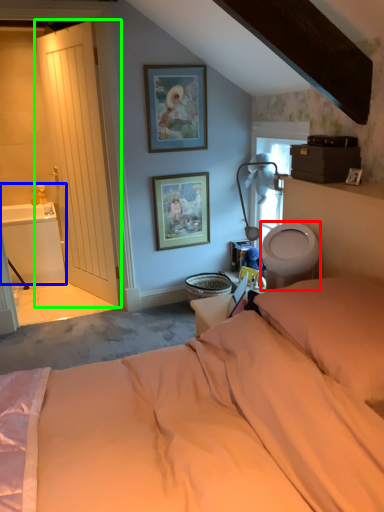
Question: Which is nearer to the toilet bowl (highlighted by a red box)? sink (highlighted by a blue box) or door (highlighted by a green box).

Choices:
 (A) sink
 (B) door

Answer: (B)